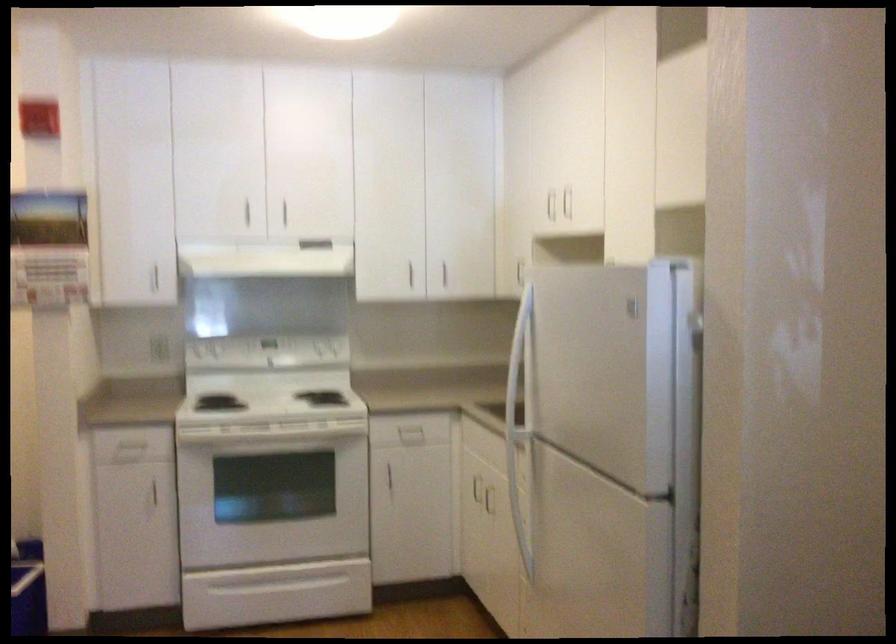
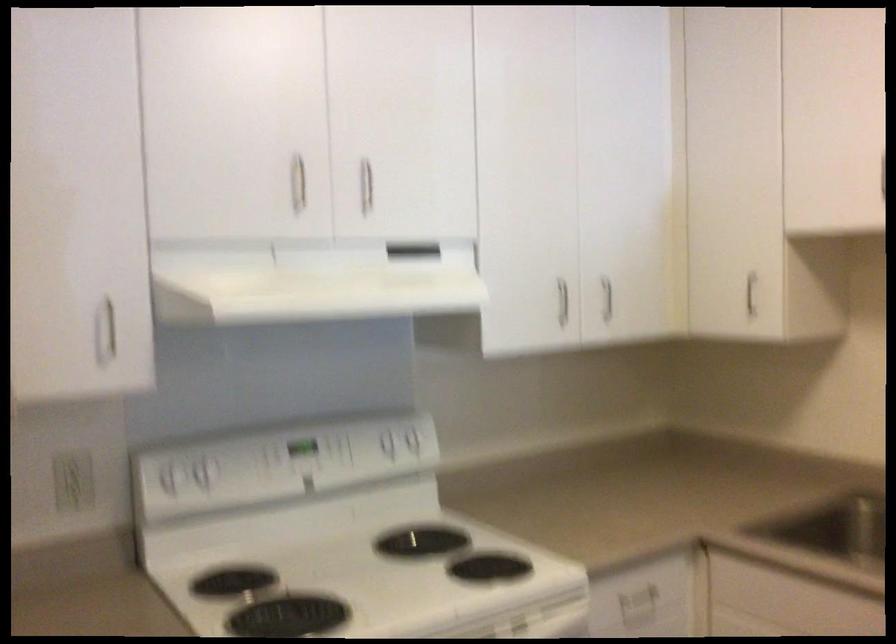
Where in the second image is the point corresponding to point 197,346 from the first image?

(169, 476)